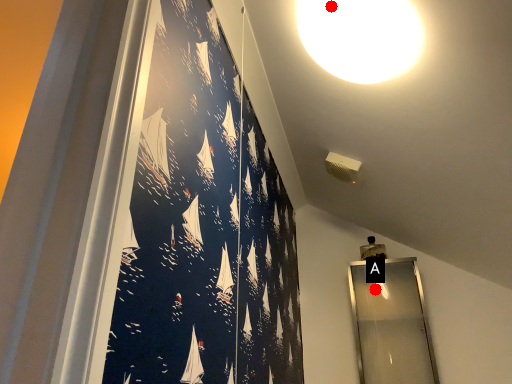
Question: Two points are circled on the image, labeled by A and B beside each circle. Which point is closer to the camera?

Choices:
 (A) A is closer
 (B) B is closer

Answer: (B)